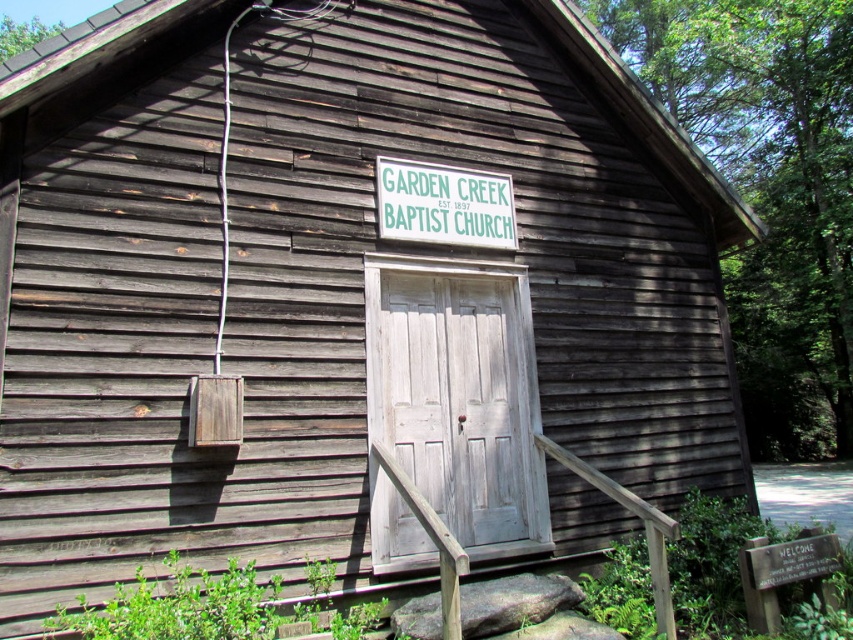
Question: Among these objects, which one is nearest to the camera?

Choices:
 (A) green wooden sign at center
 (B) white wood door at center

Answer: (B)

Question: Is white wood door at center positioned at the back of green wooden sign at center?

Choices:
 (A) yes
 (B) no

Answer: (B)

Question: Which point appears closest to the camera in this image?

Choices:
 (A) (444, 349)
 (B) (396, 193)

Answer: (B)

Question: Is white wood door at center below green wooden sign at center?

Choices:
 (A) yes
 (B) no

Answer: (A)

Question: Is white wood door at center above green wooden sign at center?

Choices:
 (A) yes
 (B) no

Answer: (B)